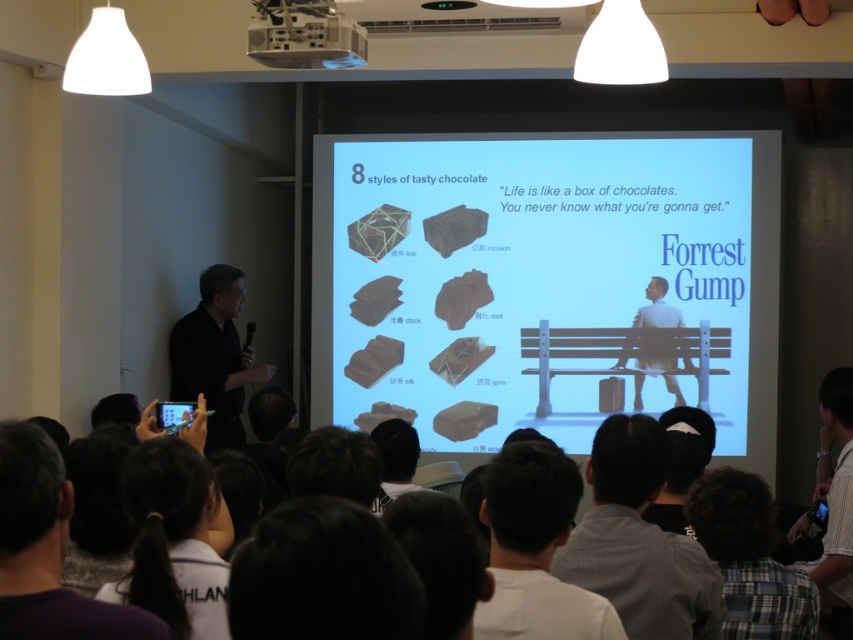
You are a speaker standing at the left side of the presentation room. You want to move closer to the projection screen. There are two points marked in the room, point [567,460] and point [640,368]. Which point should you walk towards to get closer to the screen?

Point [567,460] is in front of point [640,368], so you should walk towards point [567,460] to get closer to the projection screen.

You are a photographer positioned at the back of the room. You need to capture a photo that includes both the dark purple shirt at lower left and the dark brown hair at center. What is the minimum distance you need to move forward to ensure both subjects are in frame?

The dark purple shirt at lower left is 5.34 feet away from the dark brown hair at center. To include both in the photo, you need to move forward until your camera can capture a field of view that encompasses both subjects separated by this distance.

You are an attendee at the presentation and want to take a photo of the slide on the matte plastic projection screen at center without the speaker blocking your view. Can you do this by standing behind the black matte suit at left?

The matte plastic projection screen at center is positioned over the black matte suit at left, so standing behind the black matte suit at left would place you directly under the screen, allowing you to take a photo without the speaker blocking your view.